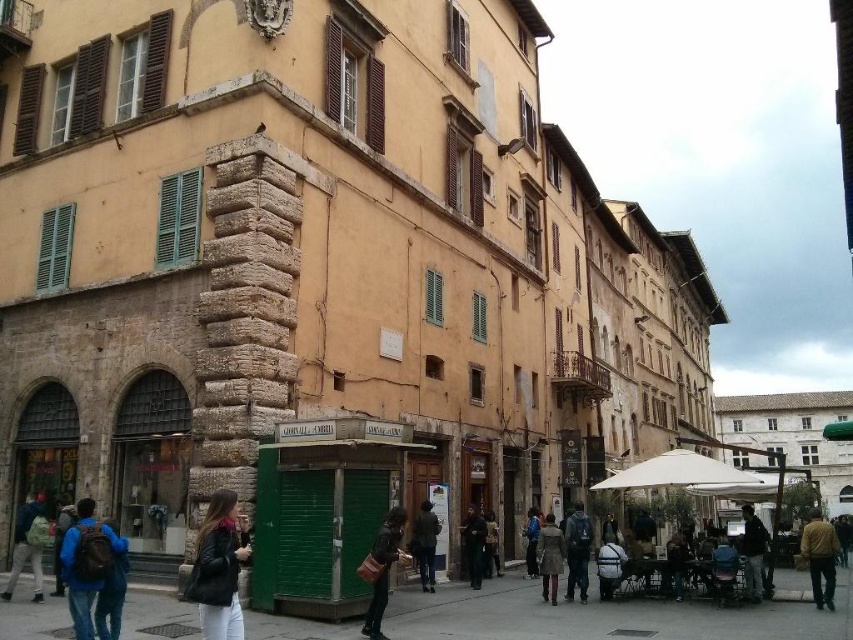
Which is above, leather brown bag at center or brown leather coat at center?

leather brown bag at center

Which is behind, point (380, 600) or point (543, 550)?

Point (543, 550)

Where is `leather brown bag at center`? leather brown bag at center is located at coordinates (383, 568).

Between point (537, 547) and point (474, 515), which one is positioned behind?

The point (537, 547) is behind.

Does brown leather coat at center have a lesser width compared to dark brown leather coat at center?

Incorrect, brown leather coat at center's width is not less than dark brown leather coat at center's.

Which is behind, point (548, 556) or point (463, 545)?

Point (463, 545)

Identify the location of brown leather coat at center. (549, 557).

Is leather jacket at lower left to the right of brown leather jacket at lower right from the viewer's perspective?

No, leather jacket at lower left is not to the right of brown leather jacket at lower right.

Describe the element at coordinates (218, 568) in the screenshot. I see `leather jacket at lower left` at that location.

The image size is (853, 640). What do you see at coordinates (218, 568) in the screenshot?
I see `leather jacket at lower left` at bounding box center [218, 568].

Identify the location of leather jacket at lower left. (218, 568).